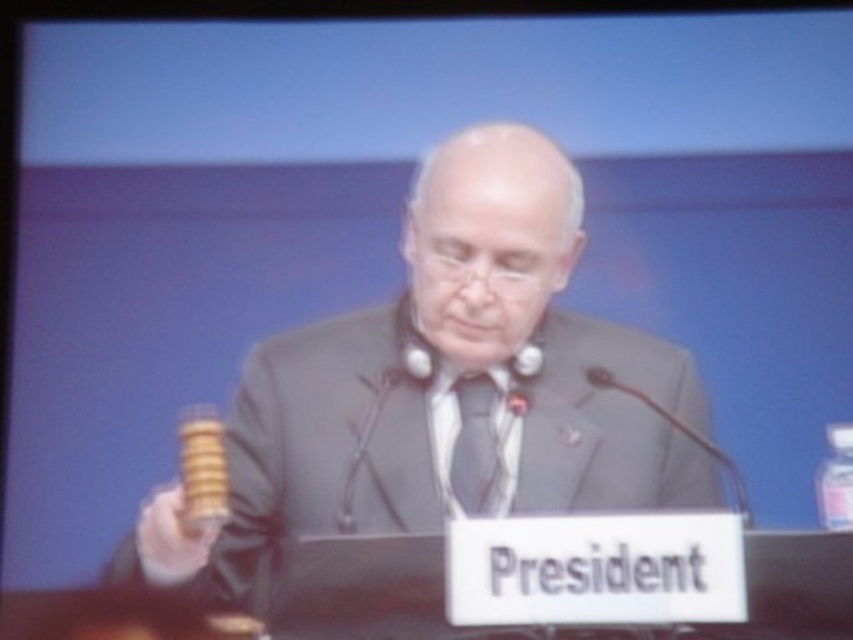
You are an event planner arranging a formal event. You need to ensure that the gray suit at center and the matte gray tie at center are visible to the audience. Which object should be placed higher to ensure both are visible?

The matte gray tie at center should be placed higher because the gray suit at center is positioned under it, so raising the tie would allow both to be seen properly.

You are a photographer setting up for a formal event. You need to ensure that the gray suit at center and the matte gray tie at center are both visible in the photo. Based on their positions, which one should you focus on first to capture both clearly?

The gray suit at center is in front of the matte gray tie at center, so focusing on the gray suit at center first will ensure both are visible in the photo.